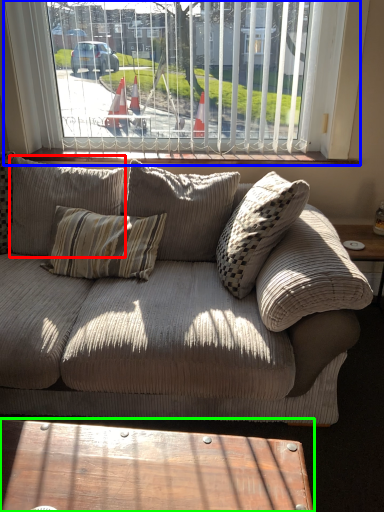
Question: Which object is the closest to the pillow (highlighted by a red box)? Choose among these: window (highlighted by a blue box) or coffee table (highlighted by a green box).

Choices:
 (A) window
 (B) coffee table

Answer: (A)